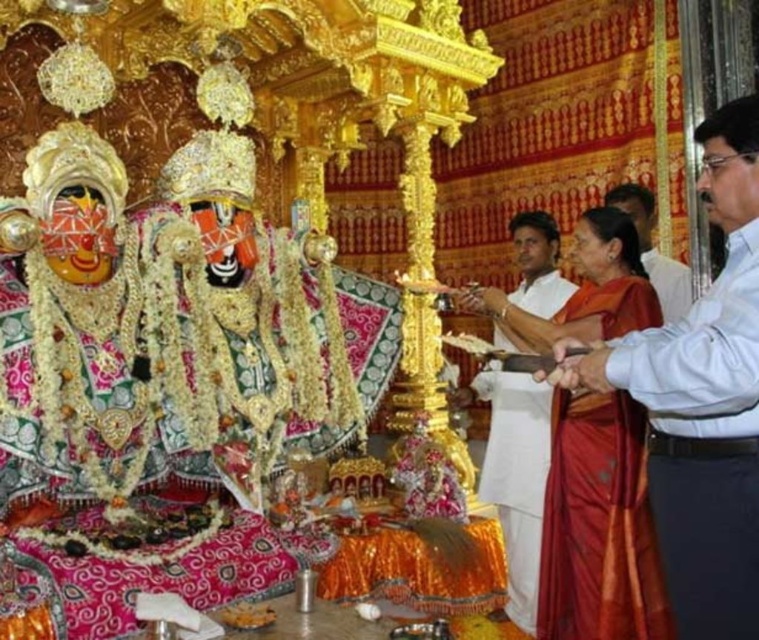
You are a photographer standing at the front of the temple platform. You want to take a picture of both the maroon silk saree at right and the silky orange sari at center. The camera you have can focus on objects within a 10 meter range. Can you capture both in a single shot without moving the camera?

The maroon silk saree at right is 9.29 meters from the silky orange sari at center. Since the camera can focus within 10 meters, both objects are within range, so yes, you can capture both in a single shot.

You are a photographer trying to capture a clear shot of both the silky red saree at right and the white cotton shirt at right from the front. Which one will appear larger in your photo?

The silky red saree at right will appear larger in the photo because it is much taller than the white cotton shirt at right.

You are an event planner arranging a cultural performance. You have two costumes available for the performers to wear on stage. The silky red saree at right and the white cotton shirt at right. Based on their sizes, which costume would you recommend for a performer who needs to move freely during a dance routine?

The silky red saree at right has a larger width than the white cotton shirt at right, so it allows for more flowing movements. Therefore, the silky red saree at right would be more suitable for a dance routine requiring free movement.